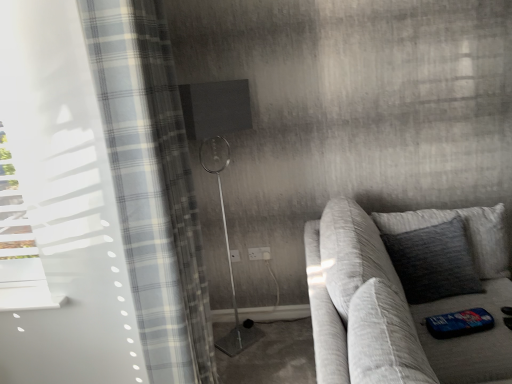
Question: Is the depth of white plastic electric outlet at center, which ranks as the first electric outlet in right-to-left order, less than that of white plastic electric outlet at center, which is counted as the second electric outlet, starting from the right?

Choices:
 (A) no
 (B) yes

Answer: (B)

Question: Does white plastic electric outlet at center, which appears as the 2th electric outlet when viewed from the left, have a lesser width compared to white plastic electric outlet at center, which is counted as the second electric outlet, starting from the right?

Choices:
 (A) no
 (B) yes

Answer: (A)

Question: From the image's perspective, does white plastic electric outlet at center, which ranks as the first electric outlet in right-to-left order, appear higher than white plastic electric outlet at center, which is counted as the second electric outlet, starting from the right?

Choices:
 (A) yes
 (B) no

Answer: (A)

Question: Is white plastic electric outlet at center, which ranks as the first electric outlet in right-to-left order, wider than white plastic electric outlet at center, which is the 1th electric outlet in left-to-right order?

Choices:
 (A) yes
 (B) no

Answer: (A)

Question: Does white plastic electric outlet at center, which ranks as the first electric outlet in right-to-left order, have a smaller size compared to white plastic electric outlet at center, which is counted as the second electric outlet, starting from the right?

Choices:
 (A) no
 (B) yes

Answer: (A)

Question: Is translucent plaid curtain at left in front of or behind textured gray pillow at right in the image?

Choices:
 (A) behind
 (B) front

Answer: (B)

Question: In the image, is translucent plaid curtain at left on the left side or the right side of textured gray pillow at right?

Choices:
 (A) left
 (B) right

Answer: (A)

Question: From a real-world perspective, is translucent plaid curtain at left positioned above or below textured gray pillow at right?

Choices:
 (A) below
 (B) above

Answer: (B)

Question: From the image's perspective, relative to textured gray pillow at right, is translucent plaid curtain at left above or below?

Choices:
 (A) below
 (B) above

Answer: (B)

Question: From their relative heights in the image, would you say white plastic electric outlet at center, which is counted as the second electric outlet, starting from the right, is taller or shorter than translucent plaid curtain at left?

Choices:
 (A) short
 (B) tall

Answer: (A)

Question: Is white plastic electric outlet at center, which is counted as the second electric outlet, starting from the right, inside or outside of translucent plaid curtain at left?

Choices:
 (A) inside
 (B) outside

Answer: (B)

Question: From the image's perspective, relative to translucent plaid curtain at left, is white plastic electric outlet at center, which is counted as the second electric outlet, starting from the right, above or below?

Choices:
 (A) above
 (B) below

Answer: (B)

Question: Considering their positions, is white plastic electric outlet at center, which is the 1th electric outlet in left-to-right order, located in front of or behind translucent plaid curtain at left?

Choices:
 (A) behind
 (B) front

Answer: (A)

Question: Considering the positions of matte black shower at center and white plastic electric outlet at center, which is counted as the second electric outlet, starting from the right, in the image, is matte black shower at center bigger or smaller than white plastic electric outlet at center, which is counted as the second electric outlet, starting from the right,?

Choices:
 (A) big
 (B) small

Answer: (A)

Question: From a real-world perspective, is matte black shower at center above or below white plastic electric outlet at center, which is the 1th electric outlet in left-to-right order?

Choices:
 (A) above
 (B) below

Answer: (A)